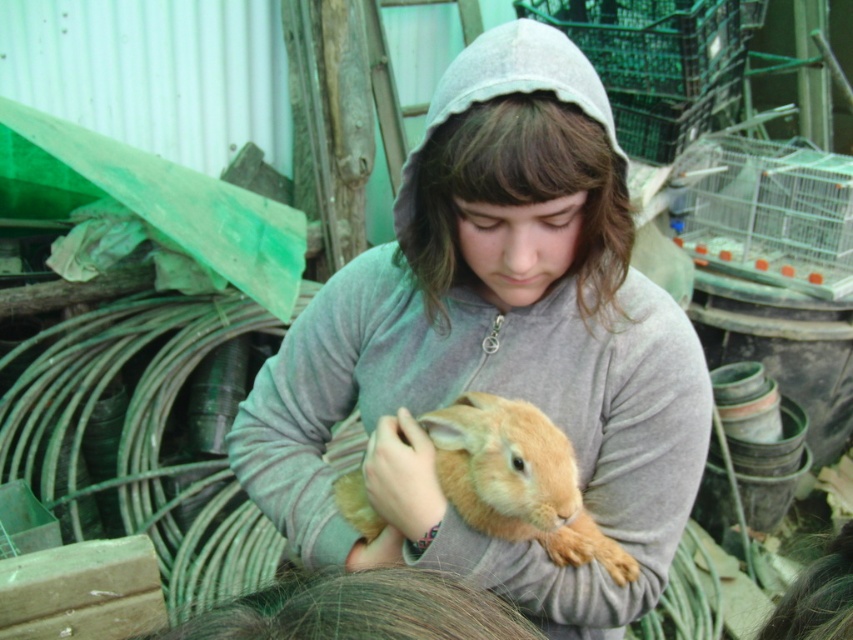
Between matte gray hoodie at center and light brown fur at center, which one is positioned lower?

light brown fur at center

Is point (665, 572) more distant than point (621, 564)?

That is True.

This screenshot has height=640, width=853. In order to click on matte gray hoodie at center in this screenshot , I will do `click(494, 344)`.